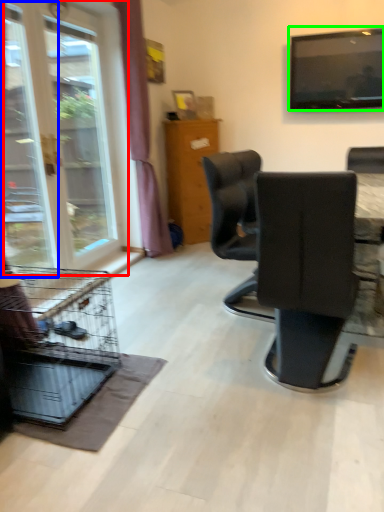
Question: Considering the real-world distances, which object is farthest from window (highlighted by a red box)? screen door (highlighted by a blue box) or television (highlighted by a green box)?

Choices:
 (A) screen door
 (B) television

Answer: (B)